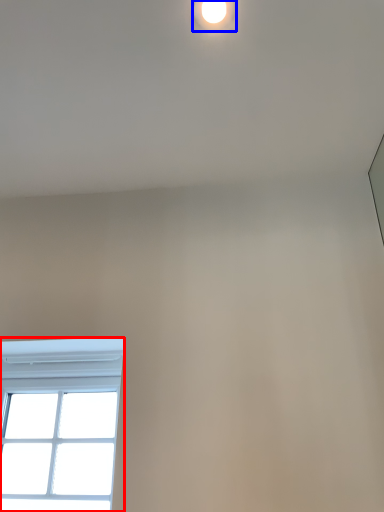
Question: Among these objects, which one is farthest to the camera, window (highlighted by a red box) or droplight (highlighted by a blue box)?

Choices:
 (A) window
 (B) droplight

Answer: (A)